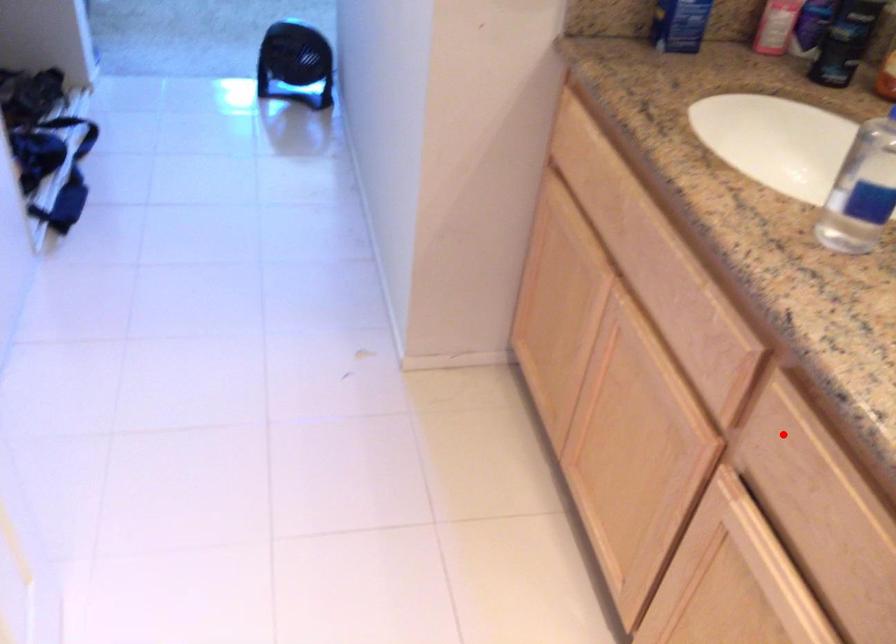
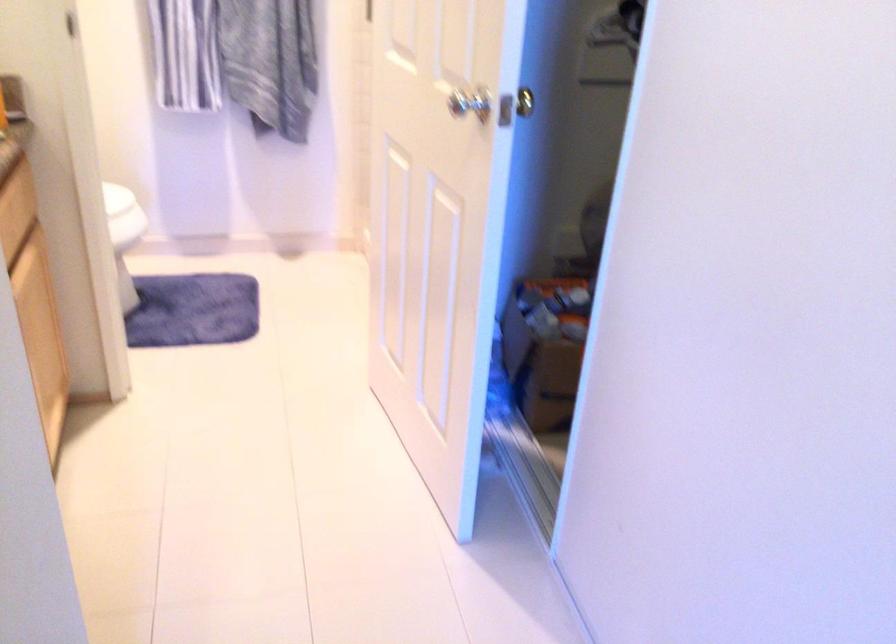
Question: I am providing you with two images of the same scene from different viewpoints. In image1, a red point is highlighted. Considering the same 3D point in image2, which of the following is correct?

Choices:
 (A) It is closer
 (B) It is farther

Answer: (B)